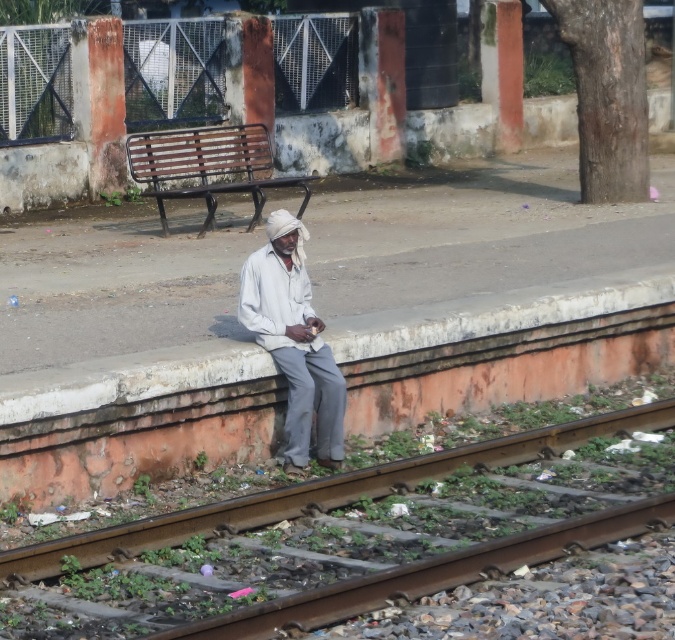
You are a pedestrian standing on the platform and want to cross from one side of the rusty metal train track at lower center to the other. The white cotton shirt at center is blocking your path. Can you step over the track without moving the shirt?

The rusty metal train track at lower center is wider than the white cotton shirt at center, so stepping over the track might be difficult due to its greater width compared to the shirt.

You are standing on the platform and want to sit down. There is a rusty metal train track at lower center and a brown wooden bench at upper center. Which object is closer to you?

The rusty metal train track at lower center is closer to you because it is positioned to the right of the brown wooden bench at upper center, which is further away.